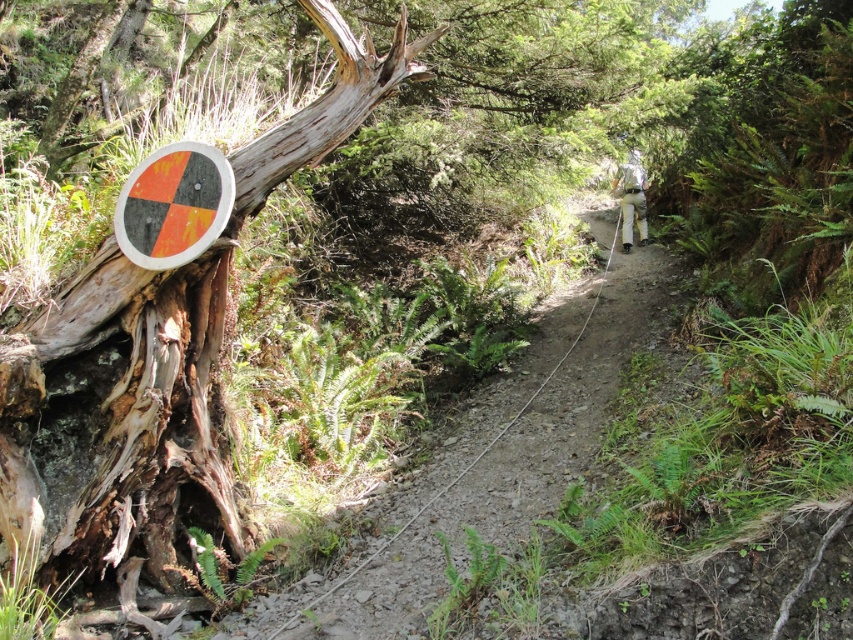
You are a hiker trying to navigate the narrow dirt path at center. You notice the weathered wood tree trunk at left nearby. Which object is wider in terms of their widths?

The weathered wood tree trunk at left is wider than the dirt path at center.

You are hiking on the trail and need to determine the relative heights of the weathered wood tree trunk at left and the orange matte sign at left. Which object is taller?

The weathered wood tree trunk at left is taller than the orange matte sign at left.